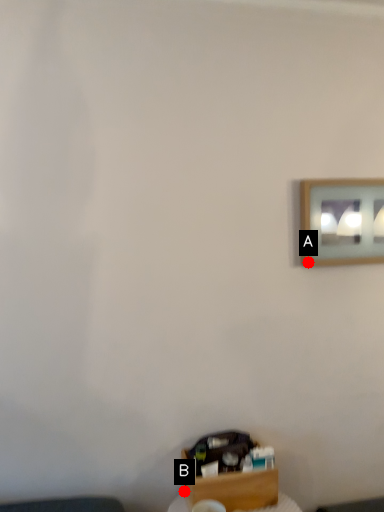
Question: Two points are circled on the image, labeled by A and B beside each circle. Which of the following is the closest to the observer?

Choices:
 (A) A is closer
 (B) B is closer

Answer: (B)